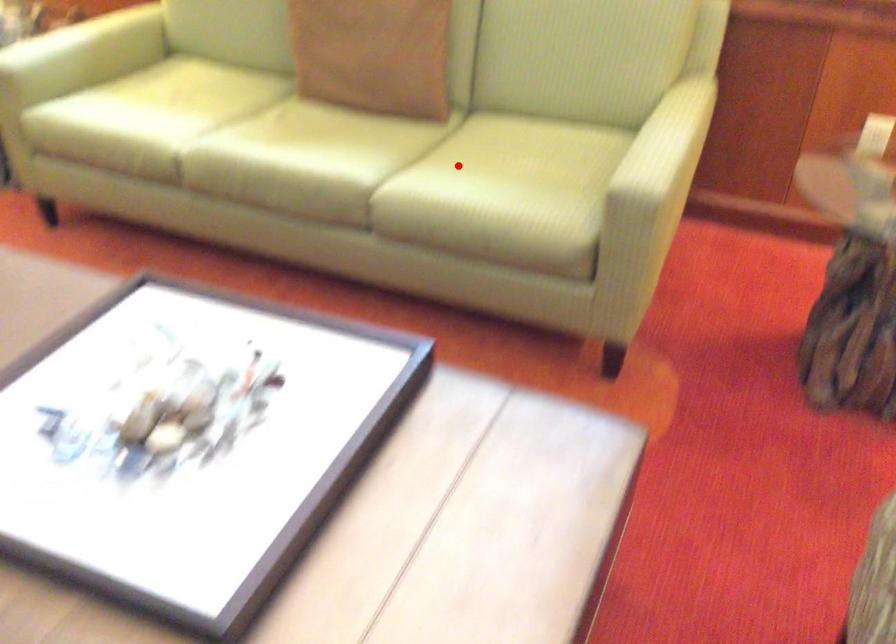
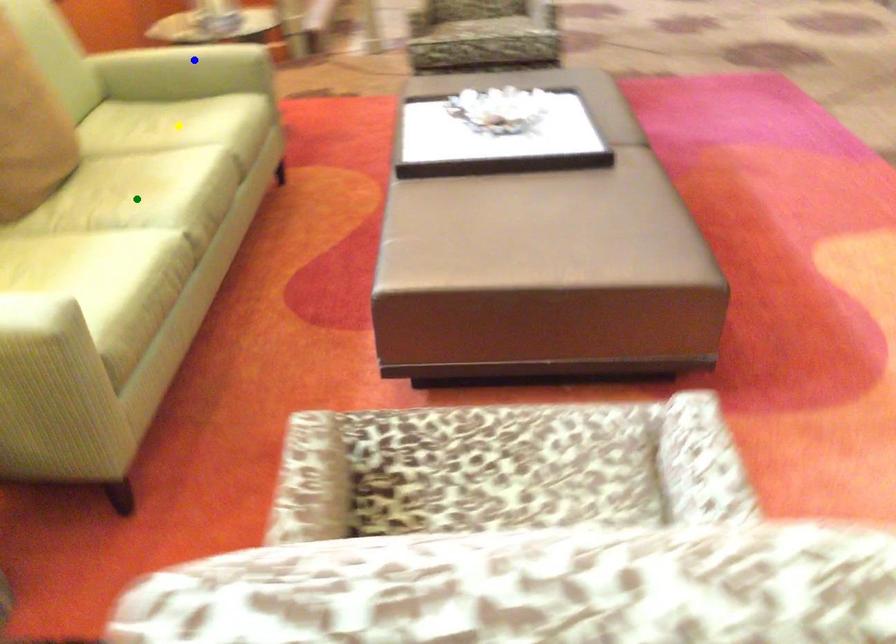
Question: I am providing you with two images of the same scene from different viewpoints. A red point is marked on the first image. You are given multiple points on the second image. In image 2, which mark is for the same physical point as the one in image 1?

Choices:
 (A) green point
 (B) blue point
 (C) yellow point

Answer: (C)